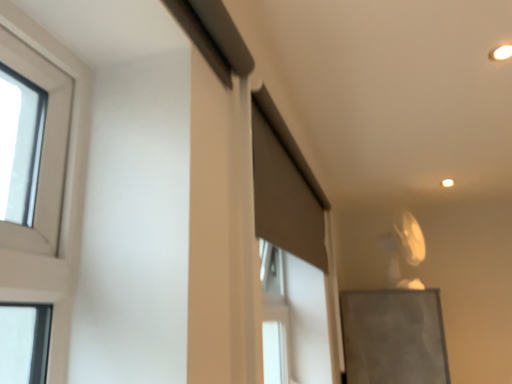
Question: Does matte gray screen door at upper center have a greater height compared to matte gray bulletin board at lower right?

Choices:
 (A) no
 (B) yes

Answer: (A)

Question: Is matte gray screen door at upper center closer to camera compared to matte gray bulletin board at lower right?

Choices:
 (A) no
 (B) yes

Answer: (B)

Question: Does matte gray screen door at upper center touch matte gray bulletin board at lower right?

Choices:
 (A) no
 (B) yes

Answer: (A)

Question: Is matte gray screen door at upper center shorter than matte gray bulletin board at lower right?

Choices:
 (A) no
 (B) yes

Answer: (B)

Question: Does matte gray screen door at upper center have a larger size compared to matte gray bulletin board at lower right?

Choices:
 (A) no
 (B) yes

Answer: (A)

Question: Does matte gray screen door at upper center appear on the left side of matte gray bulletin board at lower right?

Choices:
 (A) yes
 (B) no

Answer: (A)

Question: Is the surface of matte gray bulletin board at lower right in direct contact with matte gray screen door at upper center?

Choices:
 (A) no
 (B) yes

Answer: (A)

Question: Is matte gray bulletin board at lower right surrounding matte gray screen door at upper center?

Choices:
 (A) yes
 (B) no

Answer: (B)

Question: Does matte gray bulletin board at lower right have a greater height compared to matte gray screen door at upper center?

Choices:
 (A) yes
 (B) no

Answer: (A)

Question: Is matte gray bulletin board at lower right positioned before matte gray screen door at upper center?

Choices:
 (A) yes
 (B) no

Answer: (B)

Question: From the image's perspective, would you say matte gray bulletin board at lower right is positioned over matte gray screen door at upper center?

Choices:
 (A) yes
 (B) no

Answer: (B)

Question: Considering the relative sizes of matte gray bulletin board at lower right and matte gray screen door at upper center in the image provided, is matte gray bulletin board at lower right bigger than matte gray screen door at upper center?

Choices:
 (A) no
 (B) yes

Answer: (B)

Question: Considering the relative positions of matte gray bulletin board at lower right and matte gray screen door at upper center in the image provided, is matte gray bulletin board at lower right to the left or to the right of matte gray screen door at upper center?

Choices:
 (A) left
 (B) right

Answer: (B)